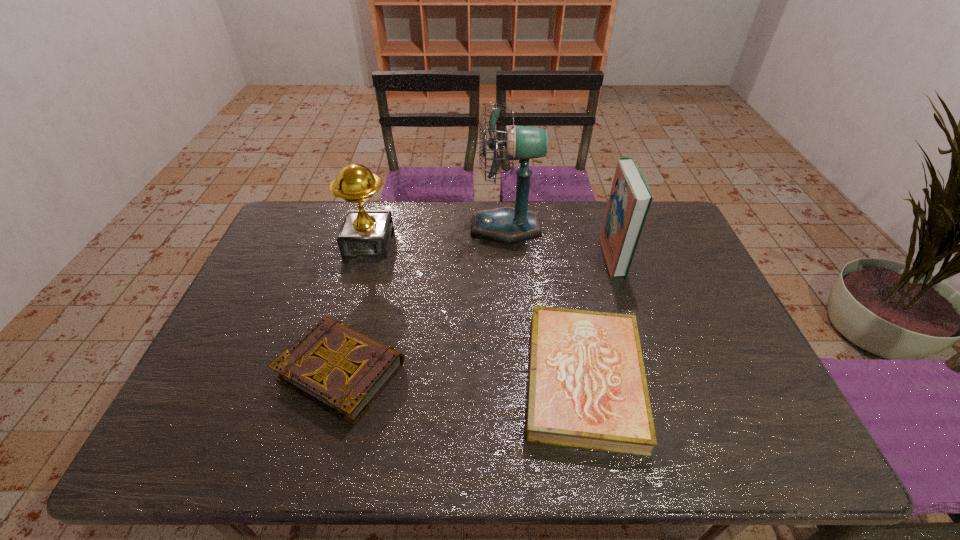
Where is `empty space that is in between the award and the tallest hardback book`? The width and height of the screenshot is (960, 540). empty space that is in between the award and the tallest hardback book is located at coordinates (491, 249).

Where is `vacant space in between the leftmost hardback book and the tallest hardback book`? Image resolution: width=960 pixels, height=540 pixels. vacant space in between the leftmost hardback book and the tallest hardback book is located at coordinates (477, 313).

Where is `free space between the tallest hardback book and the leftmost hardback book`? The image size is (960, 540). free space between the tallest hardback book and the leftmost hardback book is located at coordinates (477, 313).

Where is `vacant point located between the farthest hardback book and the fan`? Image resolution: width=960 pixels, height=540 pixels. vacant point located between the farthest hardback book and the fan is located at coordinates (559, 241).

The width and height of the screenshot is (960, 540). I want to click on empty space that is in between the award and the fan, so click(437, 235).

Locate an element on the screen. The width and height of the screenshot is (960, 540). free space between the tallest object and the tallest hardback book is located at coordinates (559, 241).

You are a GUI agent. You are given a task and a screenshot of the screen. Output one action in this format:
    pyautogui.click(x=<x>, y=<y>)
    Task: Click on the object that stands as the second closest to the award
    The image size is (960, 540).
    Given the screenshot: What is the action you would take?
    pyautogui.click(x=343, y=370)

I want to click on object identified as the fourth closest to the farthest hardback book, so click(x=364, y=233).

Image resolution: width=960 pixels, height=540 pixels. I want to click on hardback book that is the second closest to the tallest hardback book, so click(343, 370).

At what (x,y) coordinates should I click in order to perform the action: click on hardback book that can be found as the third closest to the award. Please return your answer as a coordinate pair (x, y). The width and height of the screenshot is (960, 540). Looking at the image, I should click on (630, 198).